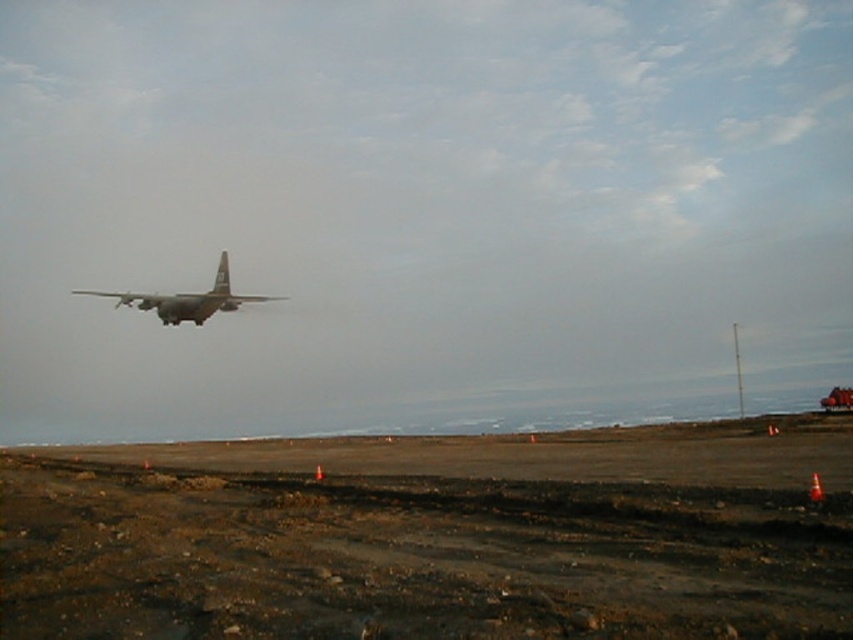
Can you confirm if brown dirt track at lower center is positioned to the right of camouflage fabric airplane at upper center?

Indeed, brown dirt track at lower center is positioned on the right side of camouflage fabric airplane at upper center.

Who is higher up, brown dirt track at lower center or camouflage fabric airplane at upper center?

camouflage fabric airplane at upper center

Where is `brown dirt track at lower center`? brown dirt track at lower center is located at coordinates (408, 557).

Does brown dirt field at lower center have a lesser height compared to camouflage fabric airplane at upper center?

No, brown dirt field at lower center is not shorter than camouflage fabric airplane at upper center.

Who is more forward, (x=590, y=470) or (x=198, y=317)?

Positioned in front is point (x=590, y=470).

Locate an element on the screen. brown dirt field at lower center is located at coordinates (531, 454).

Does brown dirt track at lower center come in front of brown dirt field at lower center?

Yes.

Is point (753, 499) less distant than point (177, 449)?

Yes.

Is point (770, 570) positioned before point (758, 465)?

That is True.

At what (x,y) coordinates should I click in order to perform the action: click on brown dirt track at lower center. Please return your answer as a coordinate pair (x, y). The image size is (853, 640). Looking at the image, I should click on (408, 557).